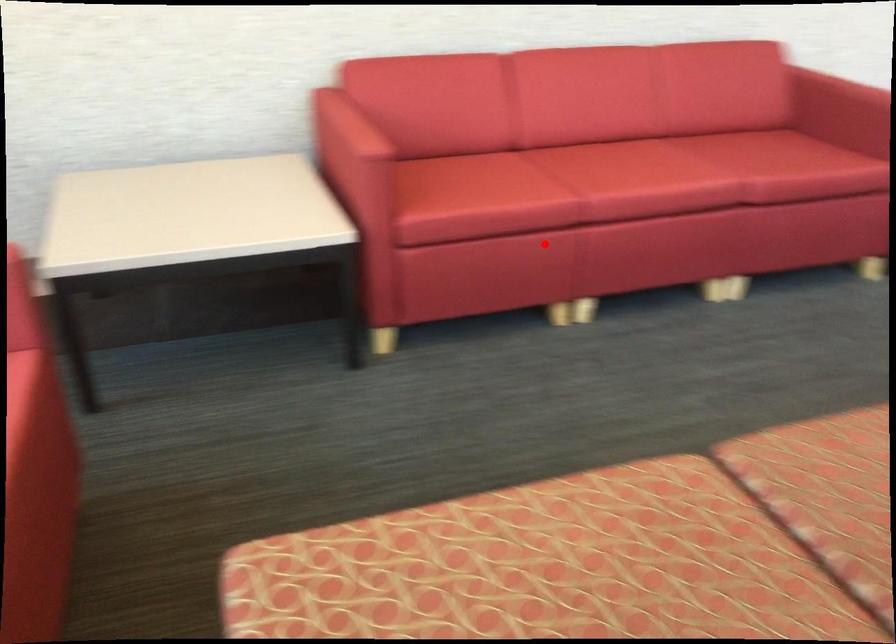
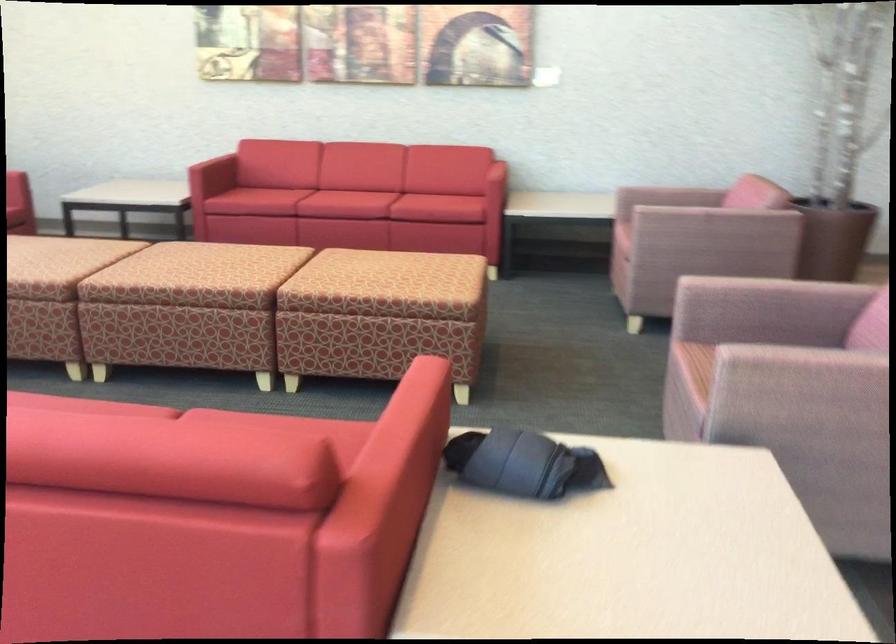
Find the pixel in the second image that matches the highlighted location in the first image.

(265, 200)